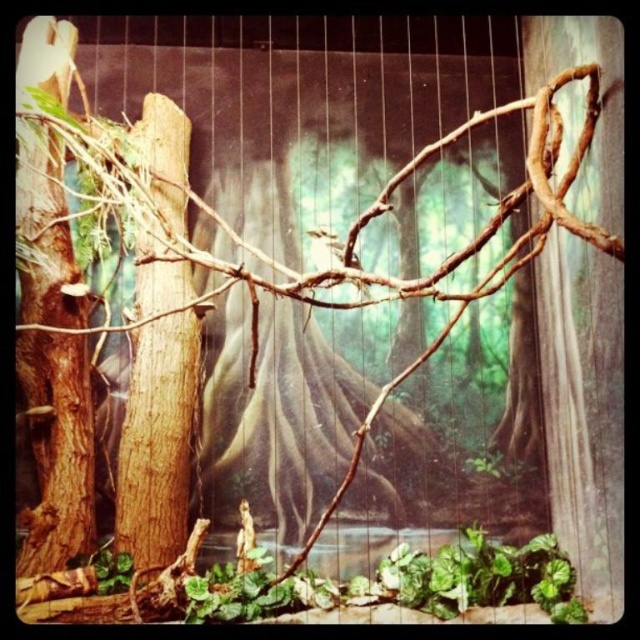
You are a zookeeper checking the enclosure for safety. You notice the brown rough tree trunk at left and the brown textured branch at center. Which object is taller?

The brown rough tree trunk at left is taller than the brown textured branch at center.